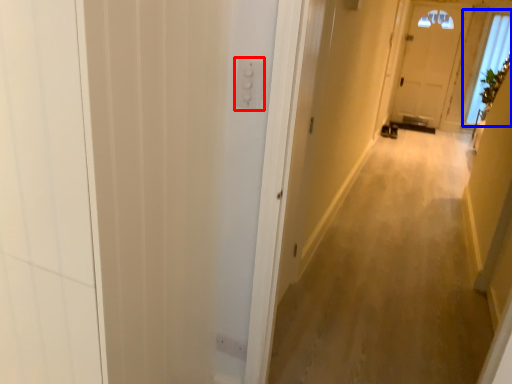
Question: Which object appears closest to the camera in this image, electric outlet (highlighted by a red box) or window (highlighted by a blue box)?

Choices:
 (A) electric outlet
 (B) window

Answer: (A)